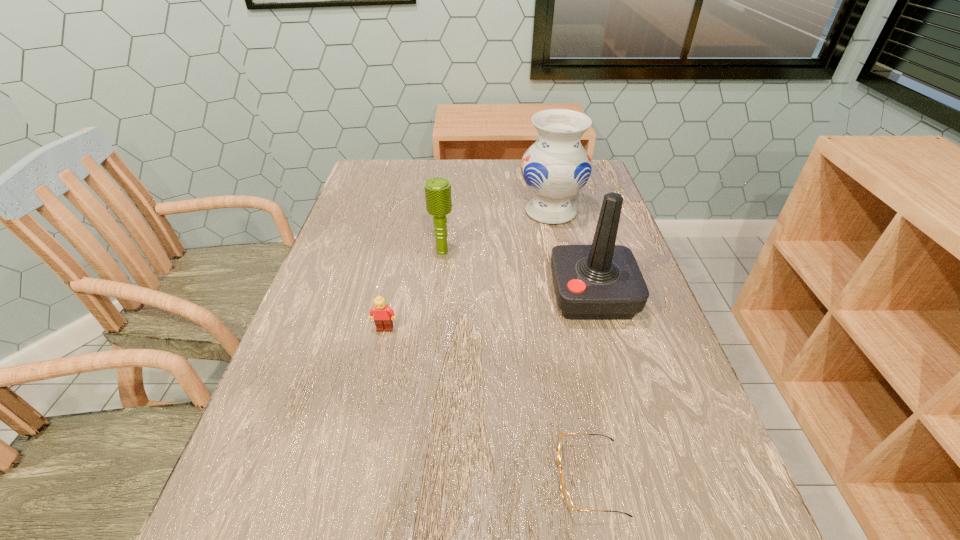
Where is `vase`? This screenshot has height=540, width=960. vase is located at coordinates (556, 167).

Find the location of a particular element. The height and width of the screenshot is (540, 960). joystick is located at coordinates (602, 281).

I want to click on the second object from left to right, so click(438, 199).

Locate an element on the screen. This screenshot has width=960, height=540. the fourth nearest object is located at coordinates (438, 199).

This screenshot has width=960, height=540. Find the location of `the fourth tallest object`. the fourth tallest object is located at coordinates (383, 316).

Locate an element on the screen. The width and height of the screenshot is (960, 540). the leftmost object is located at coordinates (383, 316).

I want to click on the nearest object, so click(x=566, y=496).

This screenshot has width=960, height=540. In order to click on the shortest object in this screenshot , I will do `click(566, 496)`.

This screenshot has width=960, height=540. What are the coordinates of `vacant space located 0.390m on the front of the farthest object` in the screenshot? It's located at (579, 340).

The height and width of the screenshot is (540, 960). What are the coordinates of `free spot located on the left of the joystick` in the screenshot? It's located at (x=464, y=295).